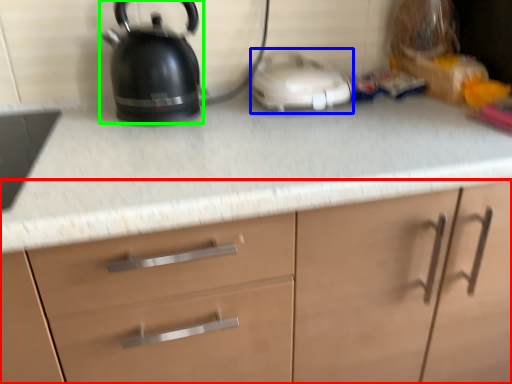
Question: Estimate the real-world distances between objects in this image. Which object is farther from cabinetry (highlighted by a red box), appliance (highlighted by a blue box) or kettle (highlighted by a green box)?

Choices:
 (A) appliance
 (B) kettle

Answer: (B)